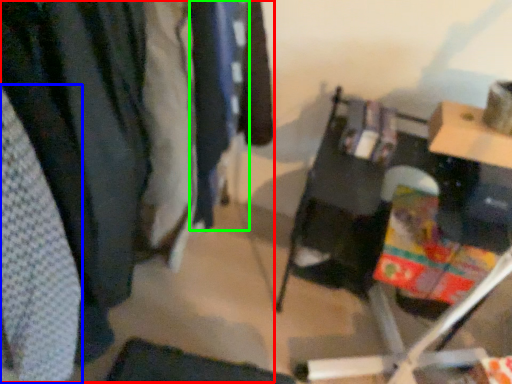
Question: Which object is the farthest from closet (highlighted by a red box)? Choose among these: clothing (highlighted by a blue box) or clothing (highlighted by a green box).

Choices:
 (A) clothing
 (B) clothing

Answer: (B)